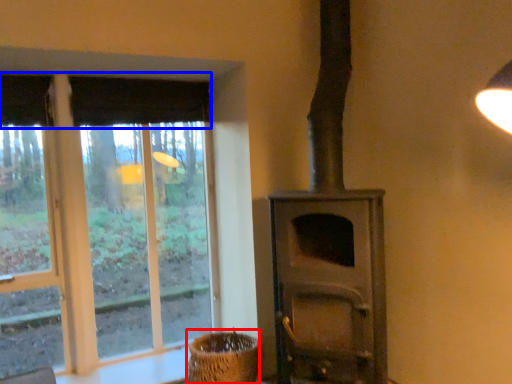
Question: Which object appears closest to the camera in this image, basket (highlighted by a red box) or curtain (highlighted by a blue box)?

Choices:
 (A) basket
 (B) curtain

Answer: (A)